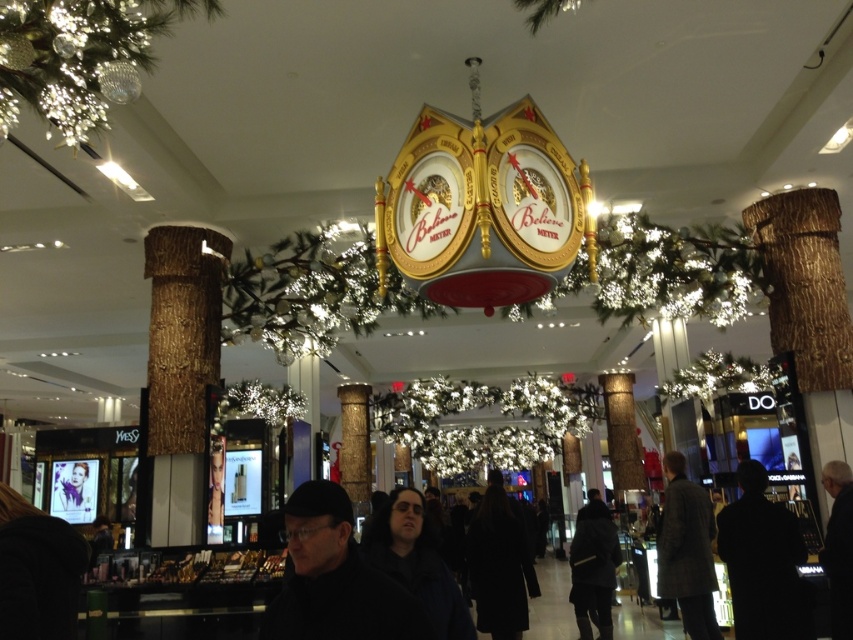
Describe the element at coordinates (688, 550) in the screenshot. I see `dark brown textured coat at lower right` at that location.

This screenshot has height=640, width=853. Describe the element at coordinates (688, 550) in the screenshot. I see `dark brown textured coat at lower right` at that location.

Find the location of `dark brown textured coat at lower right`. dark brown textured coat at lower right is located at coordinates (688, 550).

In the scene shown: Does dark matte coat at center appear on the left side of dark gray suit at lower right?

Correct, you'll find dark matte coat at center to the left of dark gray suit at lower right.

Find the location of a particular element. This screenshot has width=853, height=640. dark matte coat at center is located at coordinates (416, 561).

Does silhouette jacket at lower right have a lesser width compared to black wool coat at center?

Indeed, silhouette jacket at lower right has a lesser width compared to black wool coat at center.

Is silhouette jacket at lower right further to camera compared to black wool coat at center?

No, silhouette jacket at lower right is closer to the viewer.

Find the location of a particular element. The width and height of the screenshot is (853, 640). silhouette jacket at lower right is located at coordinates (763, 563).